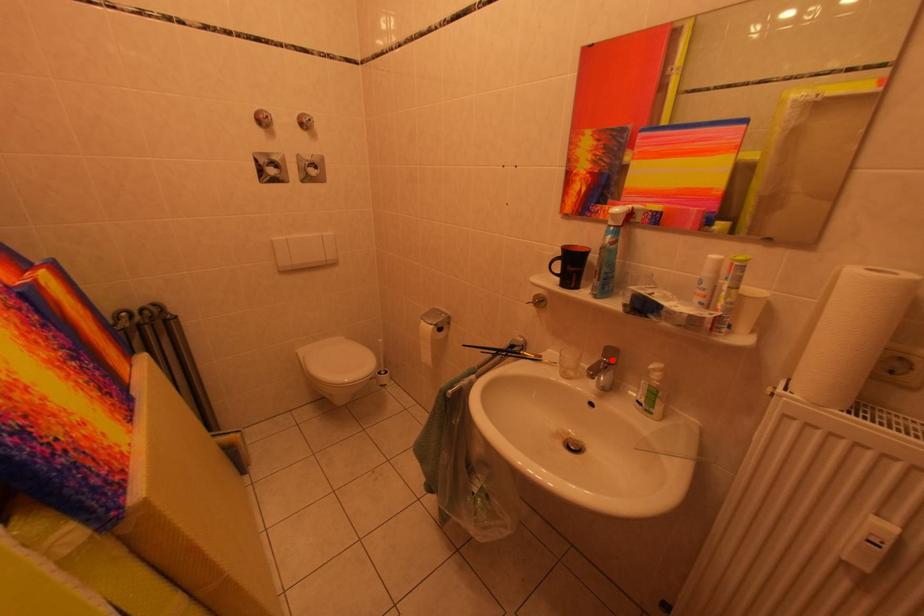
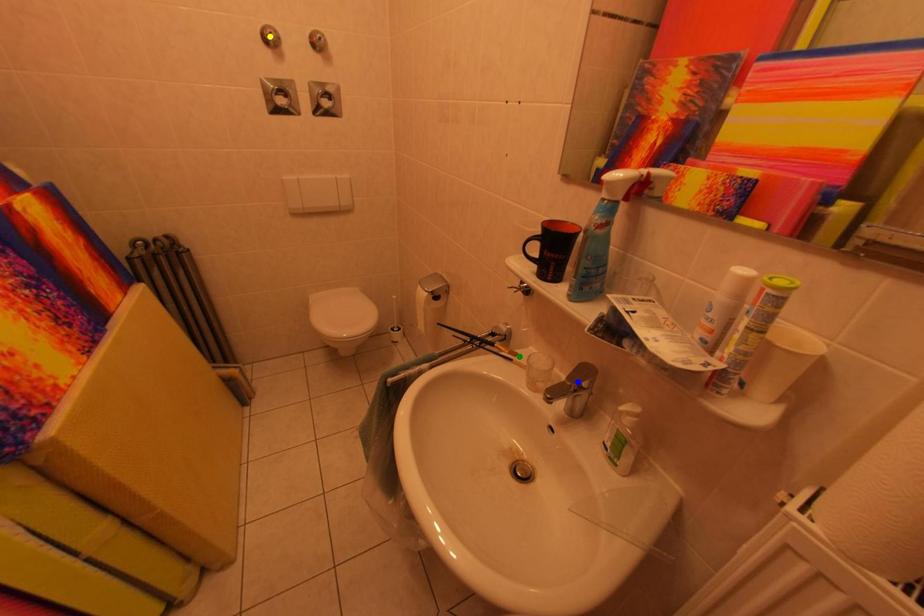
Question: I am providing you with two images of the same scene from different viewpoints. A red point is marked on the first image. You are given multiple points on the second image. In image 2, which mark is for the same physical point as the one in image 1?

Choices:
 (A) green point
 (B) yellow point
 (C) blue point

Answer: (C)